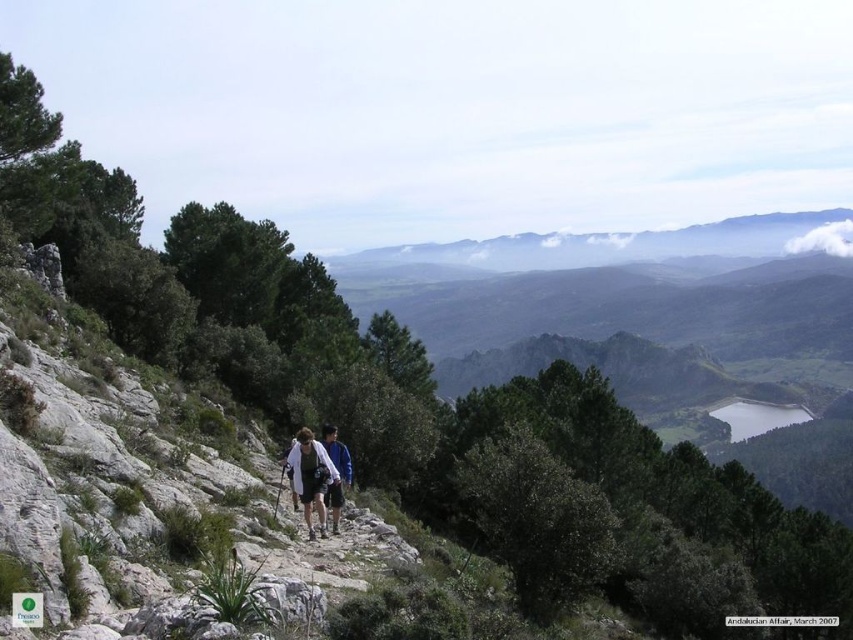
Based on the photo, you are a hiker on the trail and want to reach the point marked as point (331, 486). You are currently at point (294, 492). Which direction should you move to get closer to your destination?

To reach point (331, 486) from point (294, 492), you should move backward since point (294, 492) is in front of point (331, 486).

You are a hiker planning to join the group in the image. You want to stand between the two hikers wearing the white fabric jacket at center and the blue fabric jacket at center. Is there enough space for you to fit in between them?

The white fabric jacket at center is positioned on the left side of the blue fabric jacket at center, so there is space between them for you to stand.

You are a hiker planning to join the group on the trail. You see the white fabric jacket at center and the blue fabric jacket at center. How far apart are these two hikers?

The white fabric jacket at center is 8.02 feet from the blue fabric jacket at center.